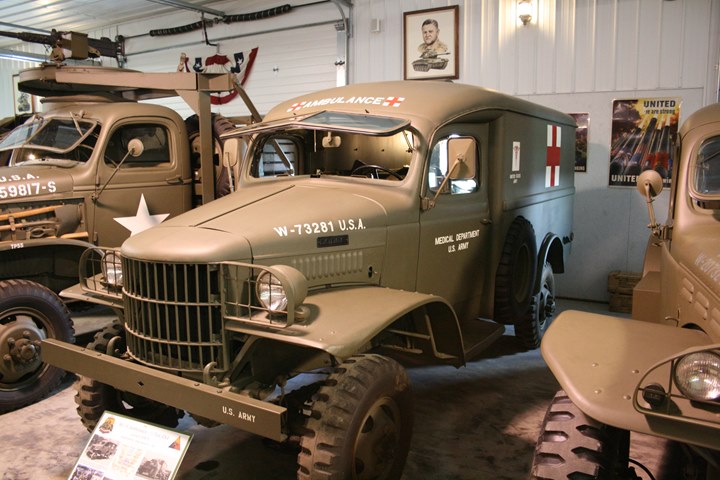
Find the location of `white fake wooden wall`. white fake wooden wall is located at coordinates (626, 72), (310, 80).